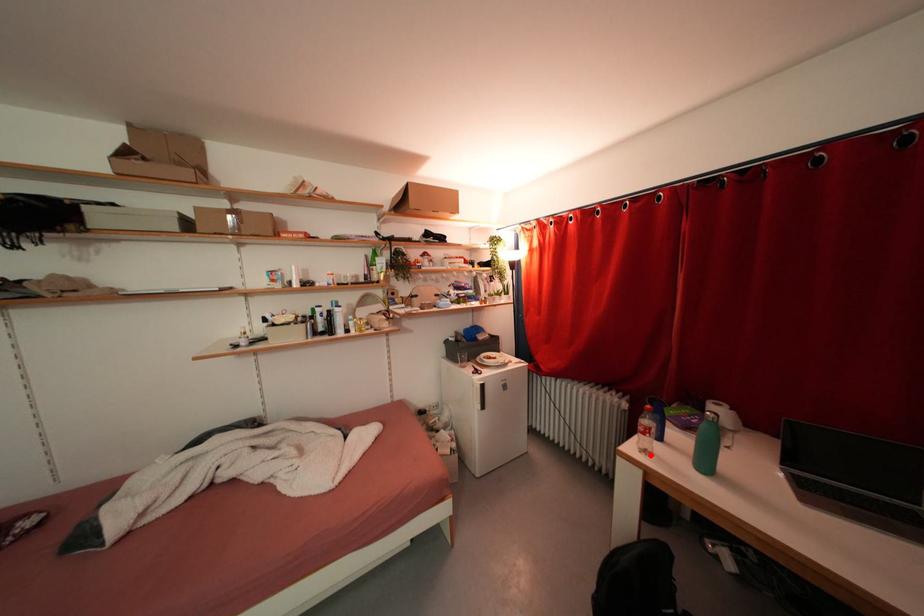
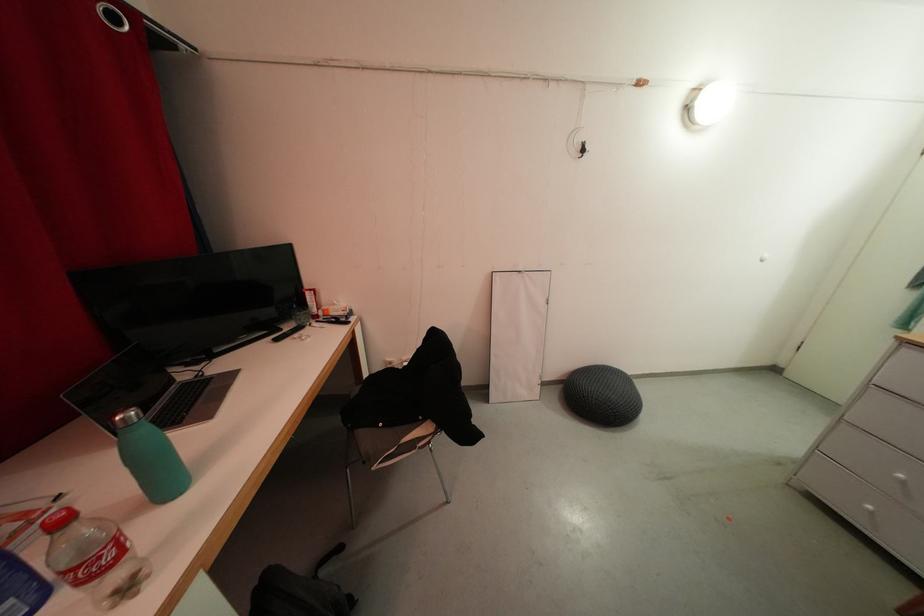
In the second image, find the point that corresponds to the highlighted location in the first image.

(134, 593)